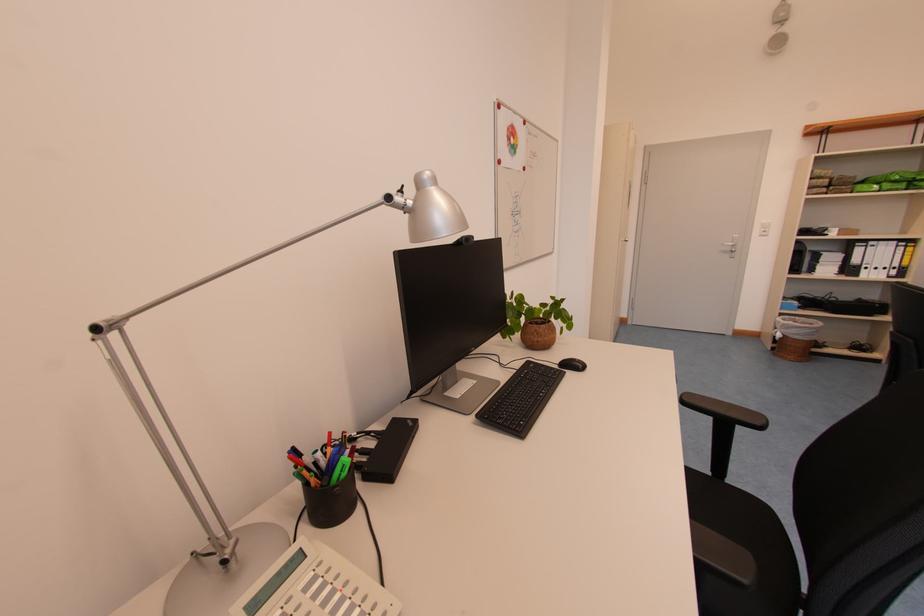
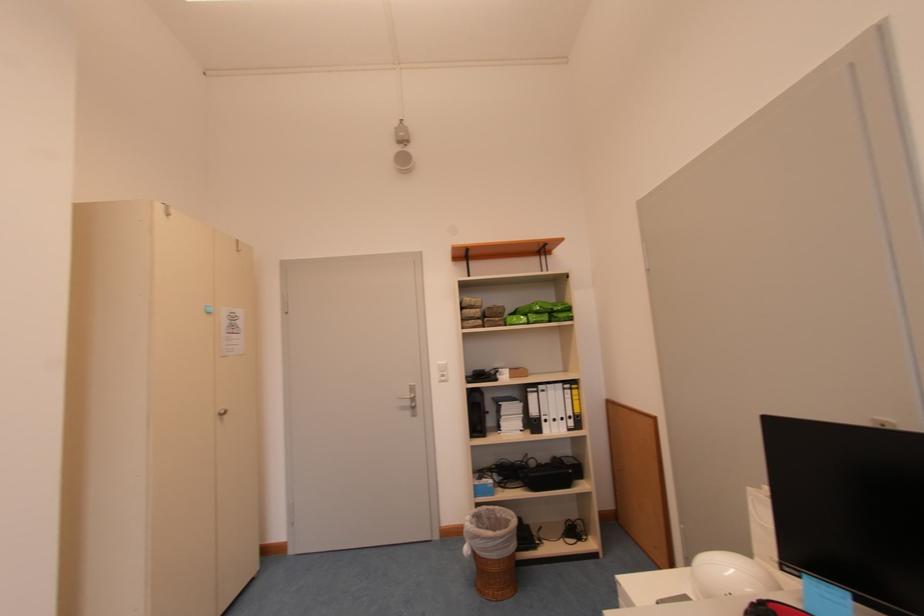
The point at (805, 321) is marked in the first image. Where is the corresponding point in the second image?

(504, 509)